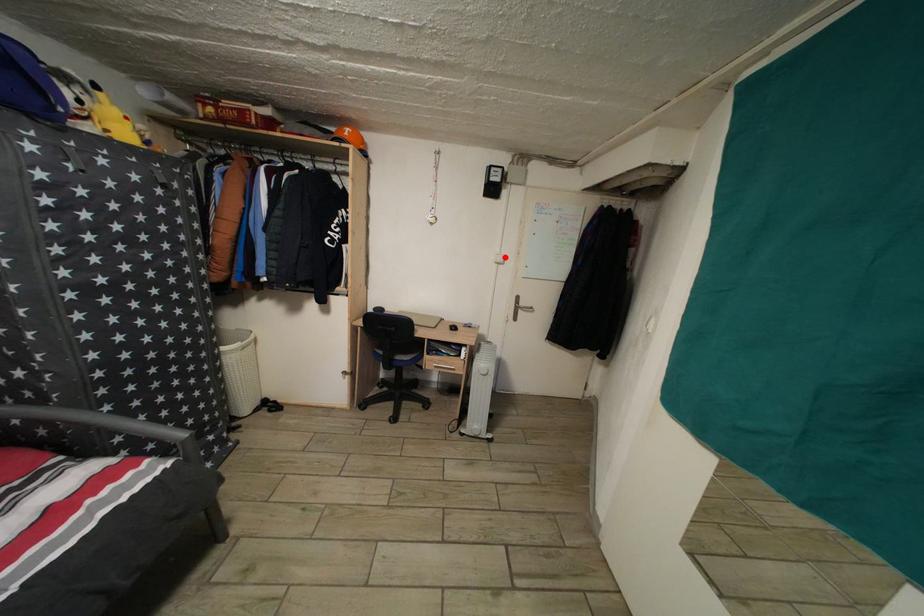
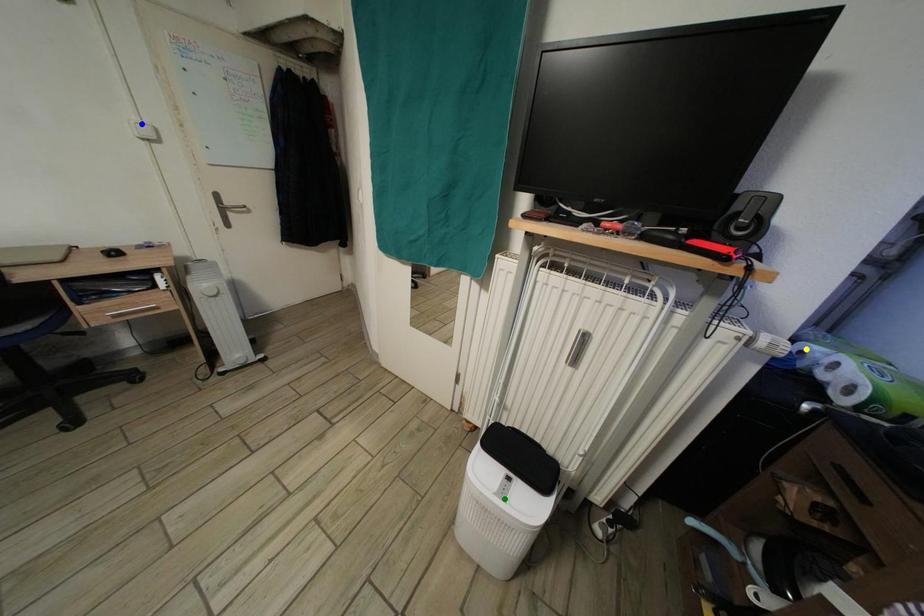
Question: I am providing you with two images of the same scene from different viewpoints. A red point is marked on the first image. You are given multiple points on the second image. Which spot in image 2 lines up with the point in image 1?

Choices:
 (A) green point
 (B) blue point
 (C) yellow point

Answer: (B)